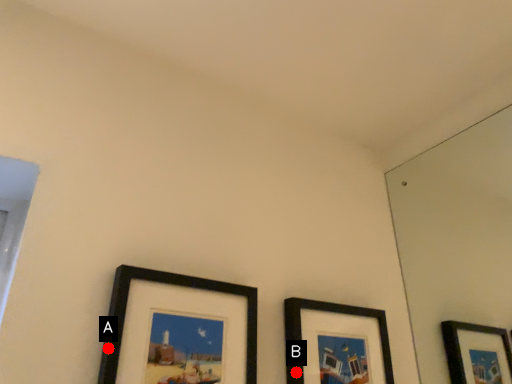
Question: Two points are circled on the image, labeled by A and B beside each circle. Which point is further to the camera?

Choices:
 (A) A is further
 (B) B is further

Answer: (B)